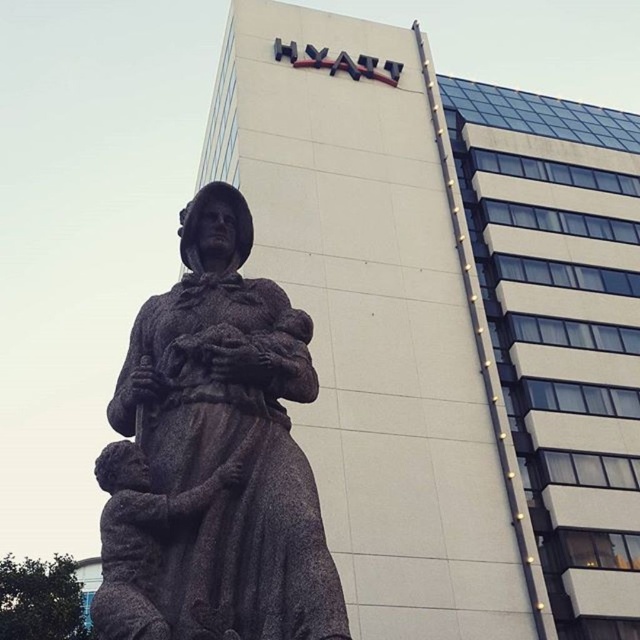
Is brown stone statue at center thinner than rustic stone statue at center?

In fact, brown stone statue at center might be wider than rustic stone statue at center.

Between brown stone statue at center and rustic stone statue at center, which one appears on the left side from the viewer's perspective?

rustic stone statue at center

Find the location of a particular element. Image resolution: width=640 pixels, height=640 pixels. brown stone statue at center is located at coordinates (212, 458).

Identify the location of brown stone statue at center. (212, 458).